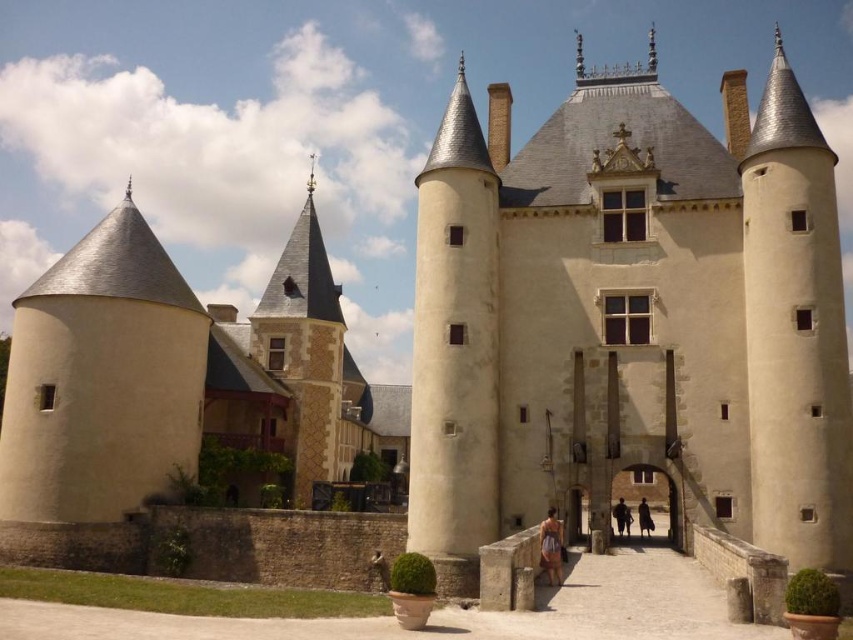
Question: Does light brown fabric dress at center appear on the right side of dark brown leather coat at center?

Choices:
 (A) yes
 (B) no

Answer: (B)

Question: Which object appears farthest from the camera in this image?

Choices:
 (A) light brown fabric dress at center
 (B) dark brown leather coat at center

Answer: (B)

Question: Is beige stone tower at center to the right of dark brown leather coat at center from the viewer's perspective?

Choices:
 (A) no
 (B) yes

Answer: (B)

Question: Does light brown fabric dress at center have a lesser width compared to dark brown leather jacket at center?

Choices:
 (A) no
 (B) yes

Answer: (B)

Question: Estimate the real-world distances between objects in this image. Which object is farther from the light brown fabric dress at center?

Choices:
 (A) beige stone tower at center
 (B) dark brown leather jacket at center
 (C) dark brown leather coat at center

Answer: (B)

Question: Which point is closer to the camera taking this photo?

Choices:
 (A) (521, 234)
 (B) (621, 516)

Answer: (A)